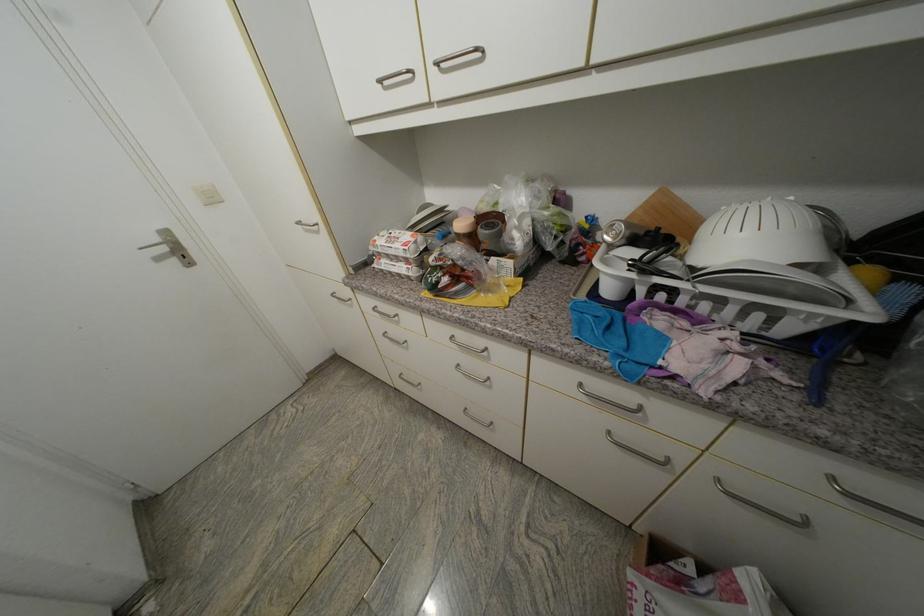
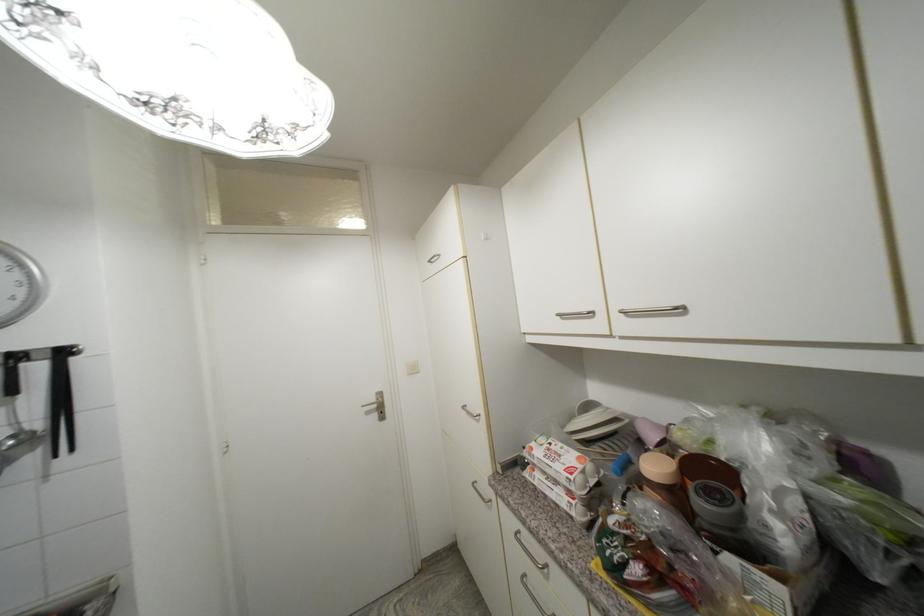
Locate, in the second image, the point that corresponds to point (387, 269) in the first image.

(541, 485)